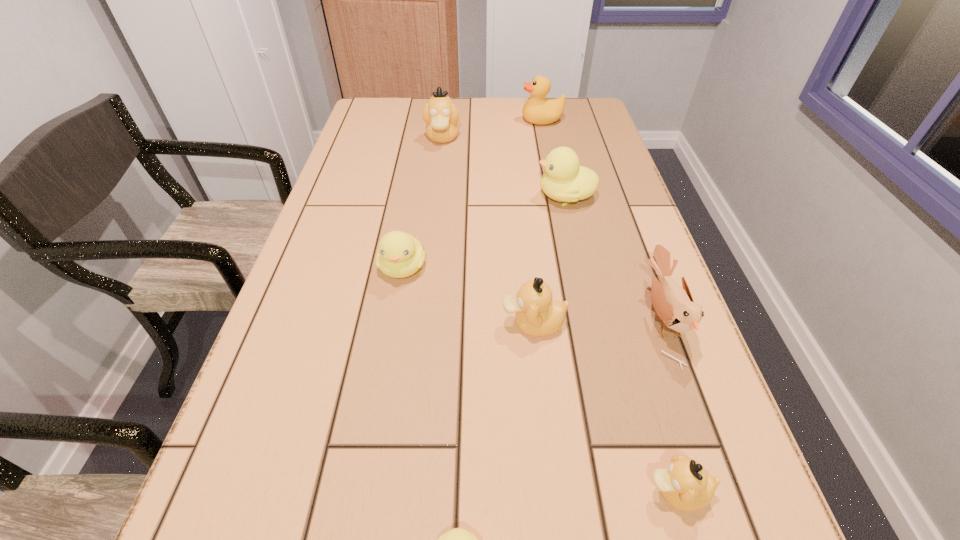
Identify the location of the smallest tan duckling. (685, 485).

This screenshot has height=540, width=960. What are the coordinates of `the fifth farthest duckling` in the screenshot? It's located at (685, 485).

I want to click on vacant point located 0.290m on the face of the farthest duckling, so click(x=434, y=214).

The width and height of the screenshot is (960, 540). What are the coordinates of `blank space located 0.220m at the beak of the duck` in the screenshot? It's located at (451, 120).

Where is `vacant area situated 0.060m at the beak of the duck`? Image resolution: width=960 pixels, height=540 pixels. vacant area situated 0.060m at the beak of the duck is located at coordinates (502, 120).

Where is `vacant space situated 0.180m at the beak of the duck`? This screenshot has height=540, width=960. vacant space situated 0.180m at the beak of the duck is located at coordinates (464, 120).

Find the location of a particular element. This screenshot has width=960, height=540. free space located 0.160m at the beak of the biggest yellow duckling is located at coordinates (472, 195).

Image resolution: width=960 pixels, height=540 pixels. I want to click on vacant region located at the beak of the biggest yellow duckling, so click(x=409, y=195).

You are a GUI agent. You are given a task and a screenshot of the screen. Output one action in this format:
    pyautogui.click(x=<x>, y=<y>)
    Task: Click on the vacant space located 0.330m at the beak of the biggest yellow duckling
    The height and width of the screenshot is (540, 960).
    Given the screenshot: What is the action you would take?
    pyautogui.click(x=404, y=195)

Locate an element on the screen. The image size is (960, 540). vacant space positioned 0.070m on the face of the second nearest tan duckling is located at coordinates (464, 323).